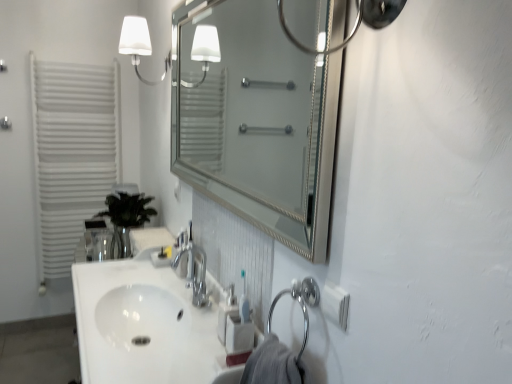
Question: Are polished chrome faucet at center and white plastic soap dispenser at lower center far apart?

Choices:
 (A) no
 (B) yes

Answer: (A)

Question: Is polished chrome faucet at center at the right side of white plastic soap dispenser at lower center?

Choices:
 (A) no
 (B) yes

Answer: (A)

Question: From a real-world perspective, is polished chrome faucet at center positioned over white plastic soap dispenser at lower center based on gravity?

Choices:
 (A) no
 (B) yes

Answer: (B)

Question: Does polished chrome faucet at center have a lesser width compared to white plastic soap dispenser at lower center?

Choices:
 (A) yes
 (B) no

Answer: (A)

Question: Is polished chrome faucet at center positioned before white plastic soap dispenser at lower center?

Choices:
 (A) no
 (B) yes

Answer: (A)

Question: Does point (226, 304) appear closer or farther from the camera than point (147, 201)?

Choices:
 (A) farther
 (B) closer

Answer: (B)

Question: From the image's perspective, is white plastic soap dispenser at lower center positioned above or below green glass vase at left?

Choices:
 (A) above
 (B) below

Answer: (B)

Question: In the image, is white plastic soap dispenser at lower center positioned in front of or behind green glass vase at left?

Choices:
 (A) behind
 (B) front

Answer: (B)

Question: Looking at their shapes, would you say white plastic soap dispenser at lower center is wider or thinner than green glass vase at left?

Choices:
 (A) thin
 (B) wide

Answer: (A)

Question: Would you say white glossy sink at center, which is counted as the 1th sink, starting from the bottom, is to the left or to the right of chrome metallic faucet at center in the picture?

Choices:
 (A) left
 (B) right

Answer: (A)

Question: Considering the positions of white glossy sink at center, the second sink in the top-to-bottom sequence, and chrome metallic faucet at center in the image, is white glossy sink at center, the second sink in the top-to-bottom sequence, bigger or smaller than chrome metallic faucet at center?

Choices:
 (A) small
 (B) big

Answer: (B)

Question: From the image's perspective, is white glossy sink at center, the second sink in the top-to-bottom sequence, positioned above or below chrome metallic faucet at center?

Choices:
 (A) below
 (B) above

Answer: (A)

Question: In the image, is white glossy sink at center, the second sink in the top-to-bottom sequence, positioned in front of or behind chrome metallic faucet at center?

Choices:
 (A) front
 (B) behind

Answer: (A)

Question: Do you think white glossy sink at center, which is counted as the 1th sink, starting from the bottom, is within silver/metallic mirror at center, or outside of it?

Choices:
 (A) outside
 (B) inside

Answer: (A)

Question: From a real-world perspective, relative to silver/metallic mirror at center, is white glossy sink at center, which is counted as the 1th sink, starting from the bottom, vertically above or below?

Choices:
 (A) above
 (B) below

Answer: (B)